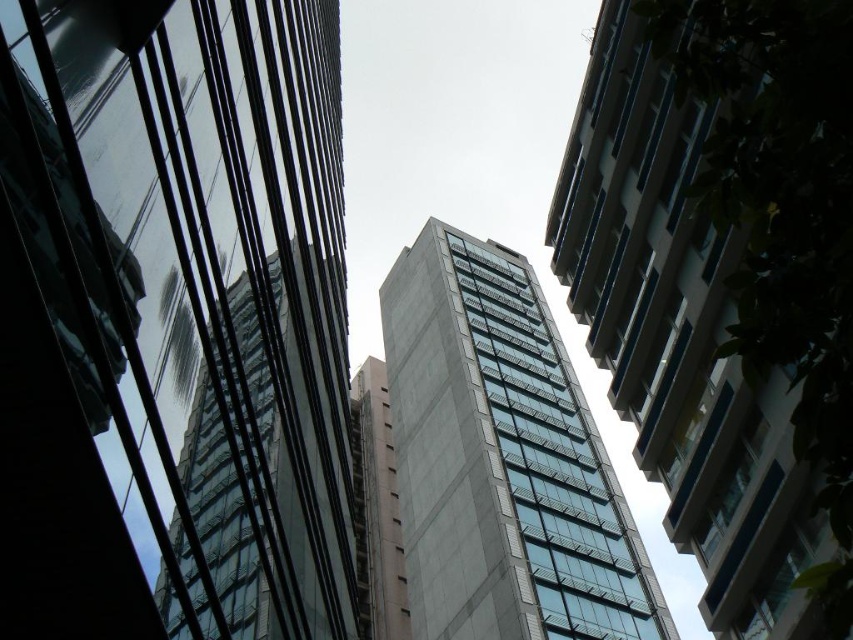
You are a drone operator planning to fly a drone between the glassy reflective building at center and the light colored building with horizontal lines. The drone has a maximum flight distance of 25 feet. Can the drone safely fly between them without exceeding its range?

The distance between the glassy reflective building at center and the light colored building with horizontal lines is 27.01 feet. Since the drone can only fly up to 25 feet, it cannot safely traverse the gap as it exceeds the maximum range.

You are an urban planner assessing the skyline. You notice the glassy reflective building at center and the pink concrete building at center. Which of these two buildings has a narrower width when viewed from this upward angle?

The glassy reflective building at center is thinner than the pink concrete building at center, so it has a narrower width when viewed from this upward angle.

You are standing at the base of the buildings and looking up. There are two points marked on the buildings. The first point is at coordinates point (x=428, y=604) and the second is at point (x=392, y=592). Which point is closer to you?

Point (x=428, y=604) is in front of point (x=392, y=592), so the first point is closer to you.